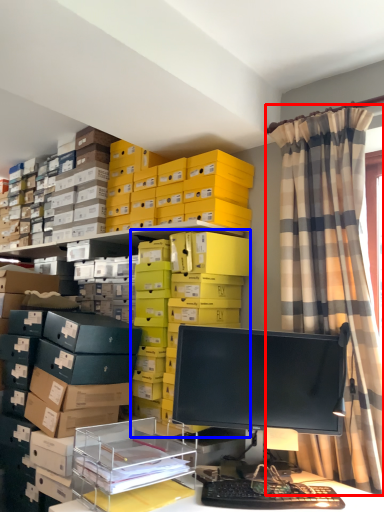
Question: Which object is closer to the camera taking this photo, curtain (highlighted by a red box) or shelf (highlighted by a blue box)?

Choices:
 (A) curtain
 (B) shelf

Answer: (A)